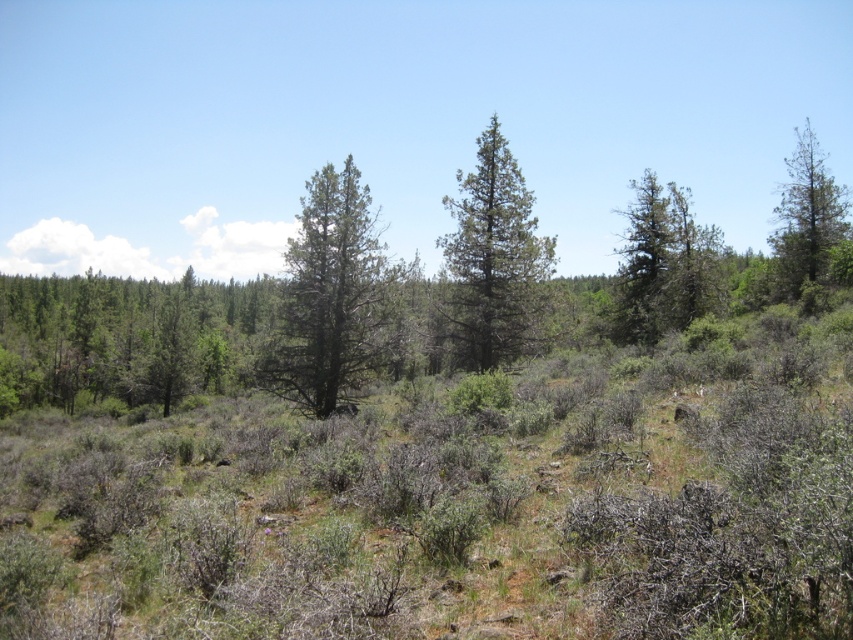
Who is positioned more to the right, green needle-like at center or green textured tree at right?

Positioned to the right is green textured tree at right.

Does green needle-like at center have a lesser width compared to green textured tree at right?

Correct, green needle-like at center's width is less than green textured tree at right's.

Who is more distant from viewer, (514, 356) or (704, 228)?

The point (704, 228) is more distant.

The height and width of the screenshot is (640, 853). In order to click on green needle-like at center in this screenshot , I will do `click(492, 259)`.

Between green needle-like tree at center and green needle-like tree at right, which one has more height?

green needle-like tree at center

Which is behind, point (283, 321) or point (625, 275)?

Point (625, 275)

Between point (344, 161) and point (624, 300), which one is positioned behind?

The point (344, 161) is more distant.

Where is `green needle-like tree at center`? The height and width of the screenshot is (640, 853). green needle-like tree at center is located at coordinates (334, 298).

Does green needle-like tree at center have a lesser height compared to green needle-like at upper right?

Yes.

At what (x,y) coordinates should I click in order to perform the action: click on green needle-like tree at center. Please return your answer as a coordinate pair (x, y). The width and height of the screenshot is (853, 640). Looking at the image, I should click on (334, 298).